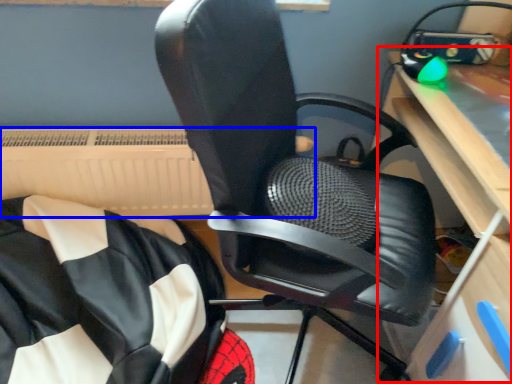
Question: Among these objects, which one is farthest to the camera, computer desk (highlighted by a red box) or radiator (highlighted by a blue box)?

Choices:
 (A) computer desk
 (B) radiator

Answer: (B)